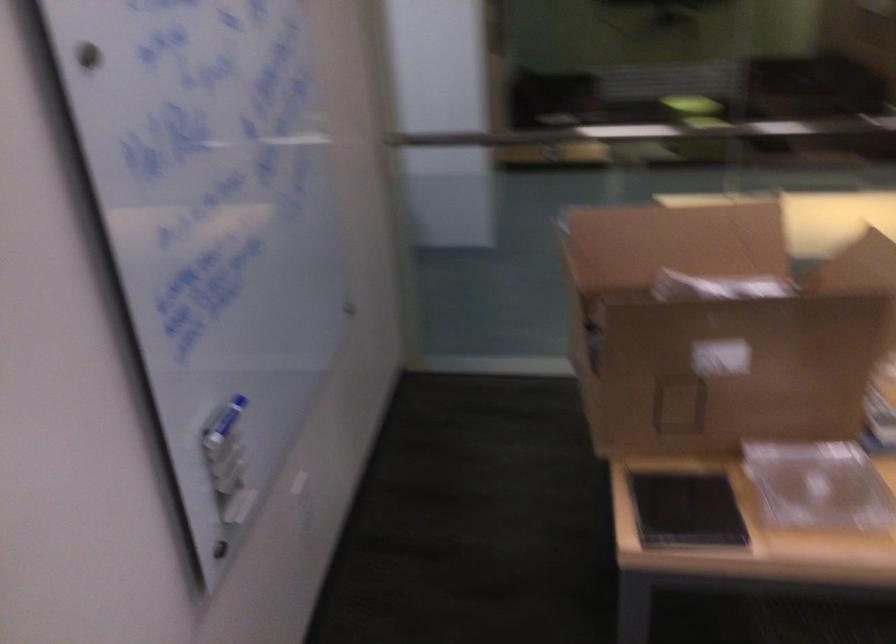
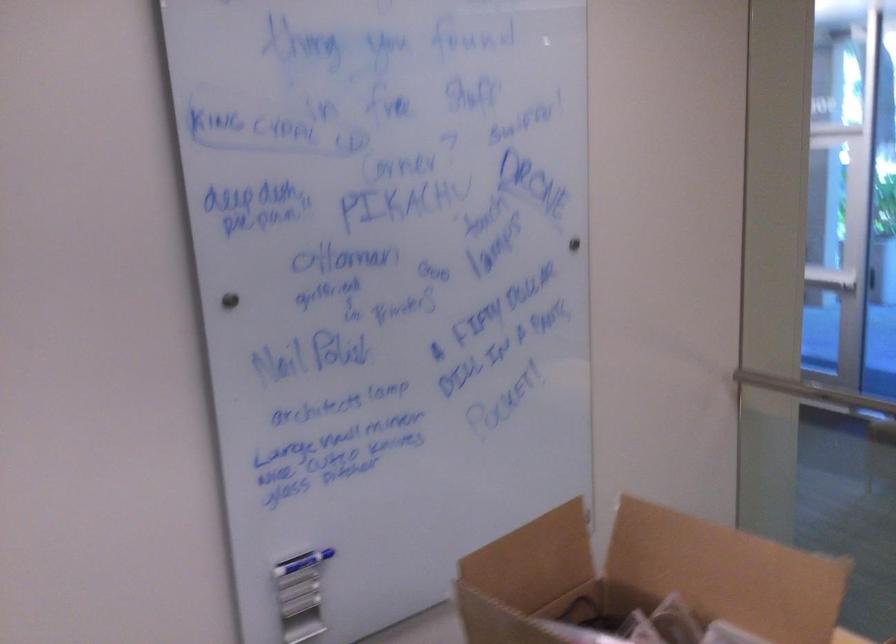
Find the pixel in the second image that matches pixel 685 234 in the first image.

(727, 573)